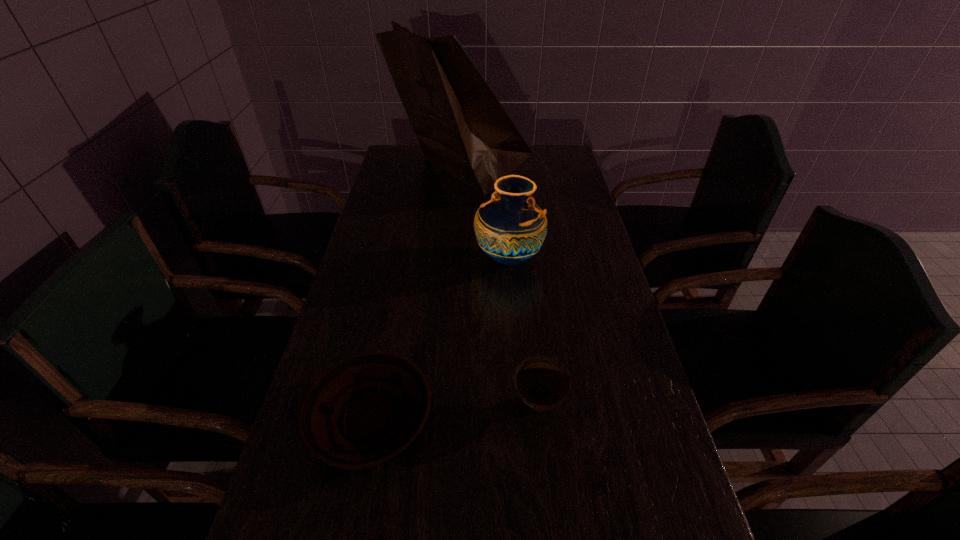
This screenshot has height=540, width=960. Identify the location of object that is at the far edge. (461, 126).

Find the location of a particular element. The image size is (960, 540). grocery bag at the left edge is located at coordinates (461, 126).

At what (x,y) coordinates should I click in order to perform the action: click on plate at the left edge. Please return your answer as a coordinate pair (x, y). The image size is (960, 540). Looking at the image, I should click on pos(366,409).

Image resolution: width=960 pixels, height=540 pixels. I want to click on object at the far left corner, so click(x=461, y=126).

What are the coordinates of `vacant region at the left edge of the desktop` in the screenshot? It's located at (403, 192).

Identify the location of free point at the right edge. Image resolution: width=960 pixels, height=540 pixels. (611, 479).

At what (x,y) coordinates should I click in order to perform the action: click on vacant area at the far left corner of the desktop. Please return your answer as a coordinate pair (x, y). The width and height of the screenshot is (960, 540). Looking at the image, I should click on (400, 167).

Image resolution: width=960 pixels, height=540 pixels. Find the location of `free spot at the far right corner of the desktop`. free spot at the far right corner of the desktop is located at coordinates (564, 162).

The height and width of the screenshot is (540, 960). I want to click on blank region between the second shortest object and the third shortest object, so click(x=523, y=332).

The width and height of the screenshot is (960, 540). I want to click on empty space between the second farthest object and the shortest object, so pyautogui.click(x=440, y=339).